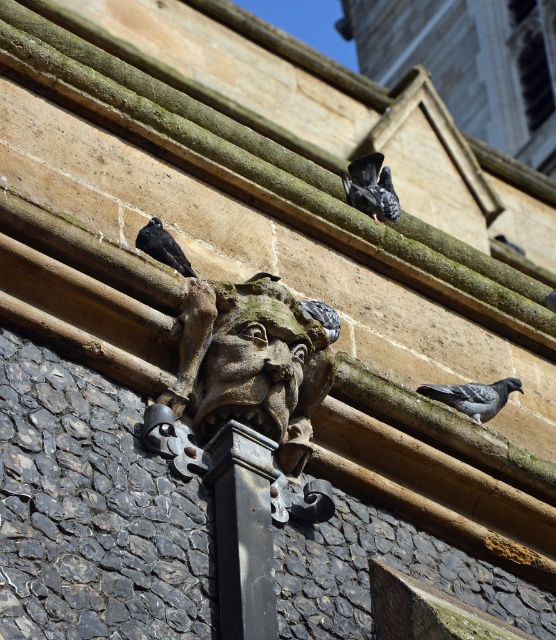
What is located at the coordinates point (x=244, y=531)?

The black stone pillar at center is located at point (x=244, y=531).

You are a window cleaner standing at the base of the building. You need to clean the black stone pillar at center and the gray matte pigeon at center. Which object should you clean first based on their positions relative to you?

The black stone pillar at center is in front of the gray matte pigeon at center, so you should clean the black stone pillar at center first since it is closer to you.

You are a construction worker assessing the building facade. You need to place a new decorative element between the black stone pillar at center and the gray matte pigeon at center. Based on their widths, which object should the decorative element be placed closer to?

The black stone pillar at center is wider than the gray matte pigeon at center. Therefore, the decorative element should be placed closer to the gray matte pigeon at center to maintain balance between the two objects.